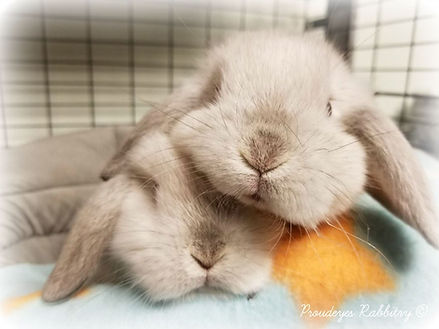
Find the location of `yellow cushion`. yellow cushion is located at coordinates (324, 259).